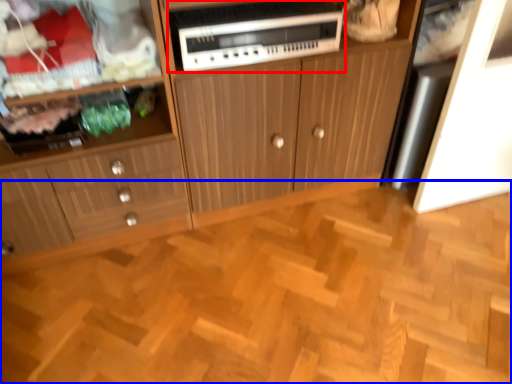
Question: Which object appears closest to the camera in this image, home appliance (highlighted by a red box) or hardwood (highlighted by a blue box)?

Choices:
 (A) home appliance
 (B) hardwood

Answer: (B)